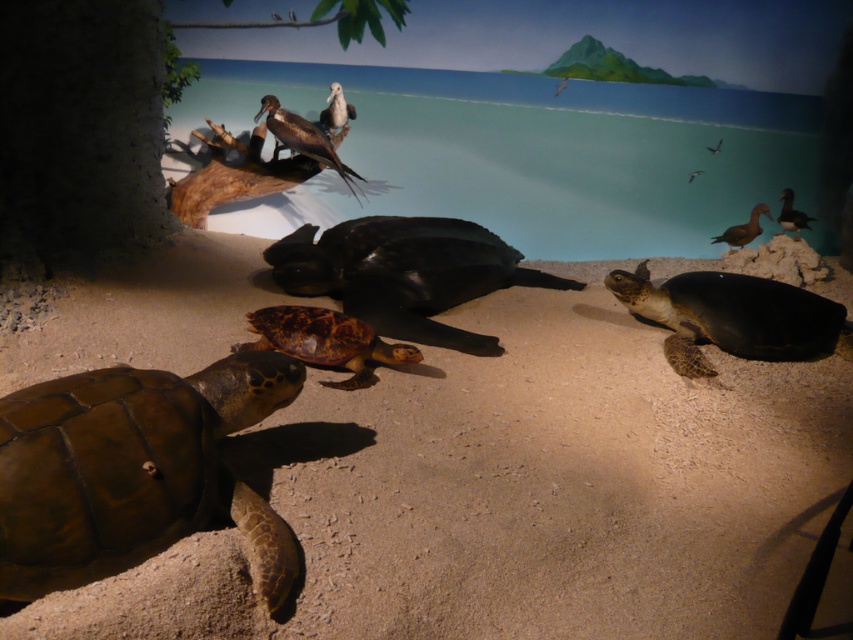
You are a museum visitor observing the turtles in the diorama. You notice the brown textured shell at right and the smooth dark green tortoise at right. Which turtle is sitting on top of the other?

The smooth dark green tortoise at right is sitting on top of the brown textured shell at right.